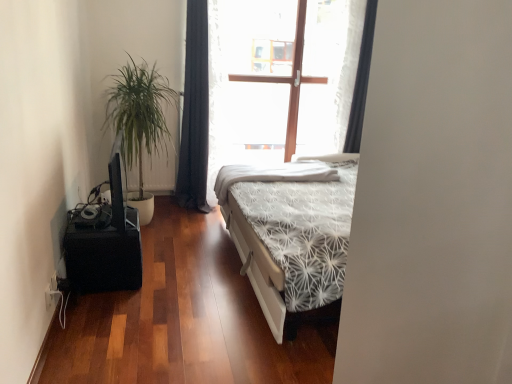
The width and height of the screenshot is (512, 384). Identify the location of black matte speaker at lower left. (104, 258).

Locate an element on the screen. white textured bedsheet at center is located at coordinates (272, 174).

Identify the location of green leafy plant at left. (139, 122).

What do you see at coordinates (361, 82) in the screenshot? Image resolution: width=512 pixels, height=384 pixels. I see `black fabric curtain at upper right, marked as the first curtain in a right-to-left arrangement` at bounding box center [361, 82].

How much space does black fabric curtain at upper right, marked as the first curtain in a right-to-left arrangement, occupy horizontally?

It is 4.16 inches.

Describe the element at coordinates (195, 112) in the screenshot. The image size is (512, 384). I see `black fabric curtain at center, the second curtain positioned from the right` at that location.

Identify the location of black matte speaker at lower left. (104, 258).

Can black matte speaker at lower left be found inside green leafy plant at left?

No, black matte speaker at lower left is located outside of green leafy plant at left.

Which of these two, green leafy plant at left or black matte speaker at lower left, is bigger?

green leafy plant at left is bigger.

Is green leafy plant at left taller than black matte speaker at lower left?

Yes.

How many degrees apart are the facing directions of black fabric curtain at upper right, marked as the first curtain in a right-to-left arrangement, and green leafy plant at left?

They differ by 90.3 degrees in their facing directions.

From a real-world perspective, is black fabric curtain at upper right, marked as the first curtain in a right-to-left arrangement, beneath green leafy plant at left?

No, from a real-world perspective, black fabric curtain at upper right, marked as the first curtain in a right-to-left arrangement, is not below green leafy plant at left.

The height and width of the screenshot is (384, 512). I want to click on houseplant that appears in front of the black fabric curtain at upper right, the second curtain viewed from the left, so click(x=139, y=122).

Would you say black fabric curtain at upper right, marked as the first curtain in a right-to-left arrangement, is outside green leafy plant at left?

Yes, black fabric curtain at upper right, marked as the first curtain in a right-to-left arrangement, is not within green leafy plant at left.

Identify the location of curtain below the black fabric curtain at upper right, marked as the first curtain in a right-to-left arrangement (from the image's perspective). This screenshot has height=384, width=512. pos(195,112).

Is black fabric curtain at center, the 1th curtain from the left, positioned far away from black fabric curtain at upper right, the second curtain viewed from the left?

Yes.

Does point (194, 99) appear closer or farther from the camera than point (371, 32)?

Point (194, 99).

How many degrees apart are the facing directions of black fabric curtain at center, the 1th curtain from the left, and black fabric curtain at upper right, the second curtain viewed from the left?

The facing directions of black fabric curtain at center, the 1th curtain from the left, and black fabric curtain at upper right, the second curtain viewed from the left, are 0.0014 degrees apart.

Which object is further away from the camera taking this photo, white textured bedsheet at center or black fabric curtain at upper right, marked as the first curtain in a right-to-left arrangement?

black fabric curtain at upper right, marked as the first curtain in a right-to-left arrangement, is further from the camera.

Is white textured bedsheet at center not close to black fabric curtain at upper right, the second curtain viewed from the left?

white textured bedsheet at center is positioned a significant distance from black fabric curtain at upper right, the second curtain viewed from the left.

Is white textured bedsheet at center aimed at black fabric curtain at upper right, the second curtain viewed from the left?

No, white textured bedsheet at center is not aimed at black fabric curtain at upper right, the second curtain viewed from the left.

How far apart are black matte speaker at lower left and green leafy plant at left?

3.52 feet.

From the picture: Is black matte speaker at lower left looking in the opposite direction of green leafy plant at left?

black matte speaker at lower left does not have its back to green leafy plant at left.

Who is smaller, black matte speaker at lower left or green leafy plant at left?

Smaller between the two is black matte speaker at lower left.

From a real-world perspective, is black matte speaker at lower left on top of green leafy plant at left?

No.

Is black matte speaker at lower left at the left side of black fabric curtain at center, the 1th curtain from the left?

Correct, you'll find black matte speaker at lower left to the left of black fabric curtain at center, the 1th curtain from the left.

Does black matte speaker at lower left turn towards black fabric curtain at center, the second curtain positioned from the right?

No, black matte speaker at lower left is not turned towards black fabric curtain at center, the second curtain positioned from the right.

Is black matte speaker at lower left positioned beyond the bounds of black fabric curtain at center, the second curtain positioned from the right?

black matte speaker at lower left lies outside black fabric curtain at center, the second curtain positioned from the right,'s area.

Where is `curtain on the left of black fabric curtain at upper right, the second curtain viewed from the left`? curtain on the left of black fabric curtain at upper right, the second curtain viewed from the left is located at coordinates (195, 112).

Considering the relative positions of black fabric curtain at upper right, the second curtain viewed from the left, and black fabric curtain at center, the second curtain positioned from the right, in the image provided, is black fabric curtain at upper right, the second curtain viewed from the left, to the right of black fabric curtain at center, the second curtain positioned from the right, from the viewer's perspective?

Yes.

Can you confirm if black fabric curtain at upper right, marked as the first curtain in a right-to-left arrangement, is smaller than black fabric curtain at center, the second curtain positioned from the right?

Yes, black fabric curtain at upper right, marked as the first curtain in a right-to-left arrangement, is smaller than black fabric curtain at center, the second curtain positioned from the right.

Is black fabric curtain at upper right, the second curtain viewed from the left, located outside black fabric curtain at center, the second curtain positioned from the right?

Yes, black fabric curtain at upper right, the second curtain viewed from the left, is not within black fabric curtain at center, the second curtain positioned from the right.

You are a GUI agent. You are given a task and a screenshot of the screen. Output one action in this format:
    pyautogui.click(x=<x>, y=<y>)
    Task: Click on the table in front of the green leafy plant at left
    
    Given the screenshot: What is the action you would take?
    pyautogui.click(x=104, y=258)

Which curtain is the 2nd one when counting from the back of the green leafy plant at left? Please provide its 2D coordinates.

[(361, 82)]

Estimate the real-world distances between objects in this image. Which object is closer to black fabric curtain at center, the 1th curtain from the left, black fabric curtain at upper right, the second curtain viewed from the left, or black matte speaker at lower left?

Based on the image, black fabric curtain at upper right, the second curtain viewed from the left, appears to be nearer to black fabric curtain at center, the 1th curtain from the left.

Based on their spatial positions, is black fabric curtain at center, the second curtain positioned from the right, or green leafy plant at left further from black matte speaker at lower left?

black fabric curtain at center, the second curtain positioned from the right, is positioned further to the anchor black matte speaker at lower left.

When comparing their distances from black fabric curtain at upper right, marked as the first curtain in a right-to-left arrangement, does white textured bedsheet at center or black matte speaker at lower left seem further?

Among the two, black matte speaker at lower left is located further to black fabric curtain at upper right, marked as the first curtain in a right-to-left arrangement.

From the image, which object appears to be farther from black matte speaker at lower left, black fabric curtain at upper right, marked as the first curtain in a right-to-left arrangement, or white textured bedsheet at center?

black fabric curtain at upper right, marked as the first curtain in a right-to-left arrangement.

Considering their positions, is black fabric curtain at upper right, the second curtain viewed from the left, positioned closer to black matte speaker at lower left than black fabric curtain at center, the second curtain positioned from the right?

Among the two, black fabric curtain at center, the second curtain positioned from the right, is located nearer to black matte speaker at lower left.

Looking at this image, from the image, which object appears to be farther from black fabric curtain at center, the 1th curtain from the left, green leafy plant at left or white textured bedsheet at center?

Among the two, white textured bedsheet at center is located further to black fabric curtain at center, the 1th curtain from the left.

From the image, which object appears to be nearer to white textured bedsheet at center, black fabric curtain at center, the 1th curtain from the left, or black matte speaker at lower left?

black fabric curtain at center, the 1th curtain from the left, is closer to white textured bedsheet at center.

Considering their positions, is black matte speaker at lower left positioned further to black fabric curtain at upper right, marked as the first curtain in a right-to-left arrangement, than black fabric curtain at center, the second curtain positioned from the right?

black matte speaker at lower left is positioned further to the anchor black fabric curtain at upper right, marked as the first curtain in a right-to-left arrangement.

Identify the location of sheet between black matte speaker at lower left and black fabric curtain at upper right, marked as the first curtain in a right-to-left arrangement, in the horizontal direction. The width and height of the screenshot is (512, 384). tap(272, 174).

Locate an element on the screen. sheet between green leafy plant at left and black fabric curtain at upper right, the second curtain viewed from the left, in the horizontal direction is located at coordinates (272, 174).

Find the location of a particular element. The image size is (512, 384). curtain between green leafy plant at left and black fabric curtain at upper right, the second curtain viewed from the left, in the horizontal direction is located at coordinates (195, 112).

At what (x,y) coordinates should I click in order to perform the action: click on houseplant between black fabric curtain at center, the 1th curtain from the left, and black matte speaker at lower left from top to bottom. Please return your answer as a coordinate pair (x, y). Image resolution: width=512 pixels, height=384 pixels. Looking at the image, I should click on (139, 122).